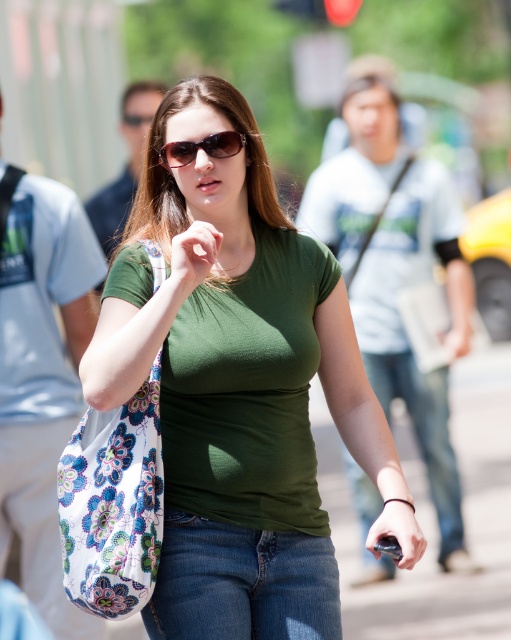
Question: Does floral-patterned fabric bag at left have a larger size compared to jeans at center?

Choices:
 (A) yes
 (B) no

Answer: (B)

Question: Does floral-patterned fabric bag at left have a lesser width compared to jeans at center?

Choices:
 (A) no
 (B) yes

Answer: (B)

Question: Is green matte shirt at center to the left of matte black sunglasses at center from the viewer's perspective?

Choices:
 (A) yes
 (B) no

Answer: (B)

Question: Among these points, which one is nearest to the camera?

Choices:
 (A) (250, 384)
 (B) (438, 497)
 (C) (101, 564)

Answer: (C)

Question: Among these points, which one is farthest from the camera?

Choices:
 (A) (413, 368)
 (B) (227, 140)

Answer: (A)

Question: Among these objects, which one is nearest to the camera?

Choices:
 (A) denim jeans at lower center
 (B) green matte shirt at center
 (C) jeans at center
 (D) matte black sunglasses at center

Answer: (B)